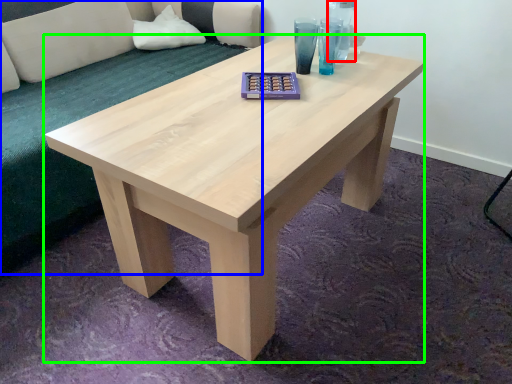
Question: Which object is positioned farthest from glass vase (highlighted by a red box)? Select from couch (highlighted by a blue box) and coffee table (highlighted by a green box).

Choices:
 (A) couch
 (B) coffee table

Answer: (A)